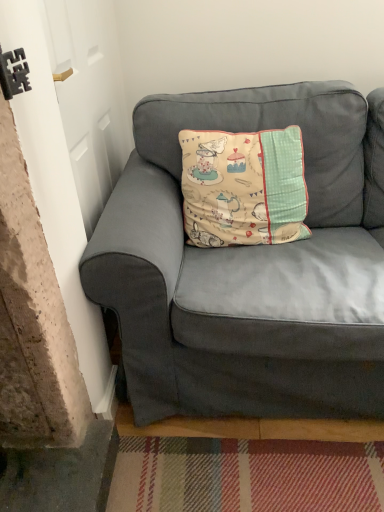
Question: Does point (195, 94) appear closer or farther from the camera than point (297, 131)?

Choices:
 (A) closer
 (B) farther

Answer: (B)

Question: Is matte gray couch at center in front of or behind beige fabric cushion at center in the image?

Choices:
 (A) behind
 (B) front

Answer: (B)

Question: Would you say matte gray couch at center is to the left or to the right of beige fabric cushion at center in the picture?

Choices:
 (A) right
 (B) left

Answer: (A)

Question: Looking at their shapes, would you say beige fabric cushion at center is wider or thinner than matte gray couch at center?

Choices:
 (A) thin
 (B) wide

Answer: (A)

Question: Is beige fabric cushion at center inside the boundaries of matte gray couch at center, or outside?

Choices:
 (A) outside
 (B) inside

Answer: (B)

Question: In the image, is beige fabric cushion at center on the left side or the right side of matte gray couch at center?

Choices:
 (A) right
 (B) left

Answer: (B)

Question: From the image's perspective, is beige fabric cushion at center positioned above or below matte gray couch at center?

Choices:
 (A) below
 (B) above

Answer: (B)